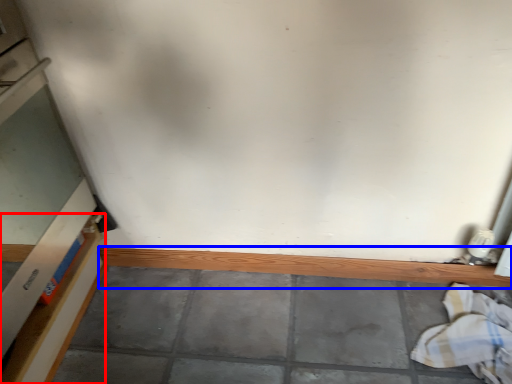
Question: Which object appears farthest to the camera in this image, shelf (highlighted by a red box) or ledge (highlighted by a blue box)?

Choices:
 (A) shelf
 (B) ledge

Answer: (B)